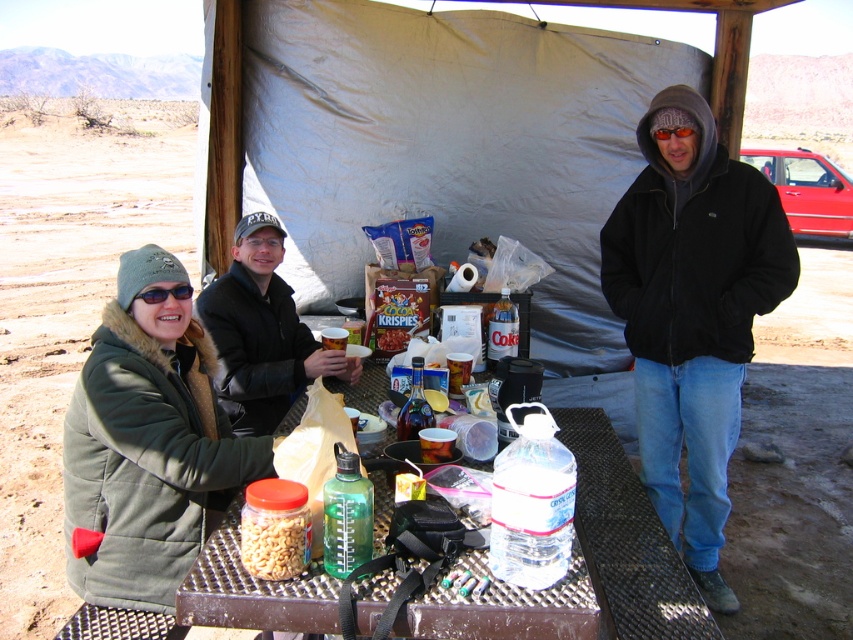
Who is more forward, (161,552) or (379,518)?

Positioned in front is point (379,518).

This screenshot has width=853, height=640. Describe the element at coordinates (148, 442) in the screenshot. I see `green fuzzy jacket at lower left` at that location.

Where is `green fuzzy jacket at lower left`? This screenshot has width=853, height=640. green fuzzy jacket at lower left is located at coordinates (148, 442).

Is metallic brown table at center in front of translucent plastic bottle at center?

Yes.

Based on the photo, can you confirm if metallic brown table at center is positioned to the right of translucent plastic bottle at center?

Yes, metallic brown table at center is to the right of translucent plastic bottle at center.

Is point (576, 413) less distant than point (405, 406)?

No, (576, 413) is further to viewer.

The width and height of the screenshot is (853, 640). What are the coordinates of `metallic brown table at center` in the screenshot? It's located at (627, 540).

Is white fabric tent at center further to the viewer compared to black fleece jacket at right?

Yes, white fabric tent at center is further from the viewer.

Is point (265, 49) less distant than point (709, 342)?

No, (265, 49) is further to viewer.

This screenshot has height=640, width=853. What are the coordinates of `white fabric tent at center` in the screenshot? It's located at (276, 93).